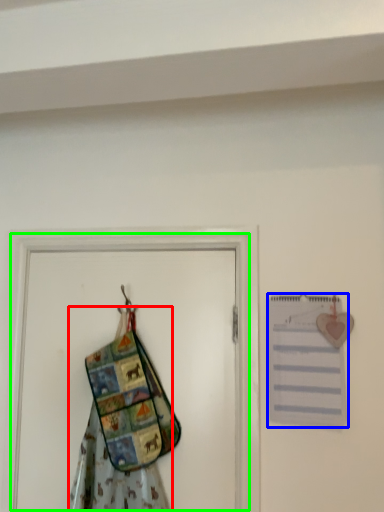
Question: Considering the real-world distances, which object is closest to fancy dress (highlighted by a red box)? journal (highlighted by a blue box) or screen door (highlighted by a green box).

Choices:
 (A) journal
 (B) screen door

Answer: (B)